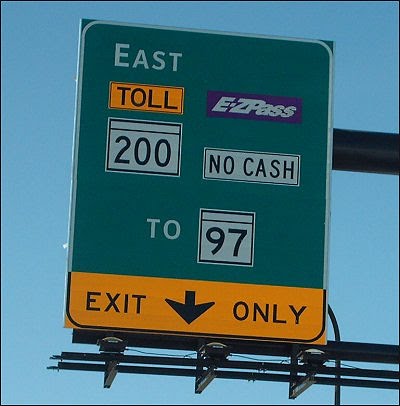
Find the location of a particular element. electrical wire is located at coordinates (154, 352).